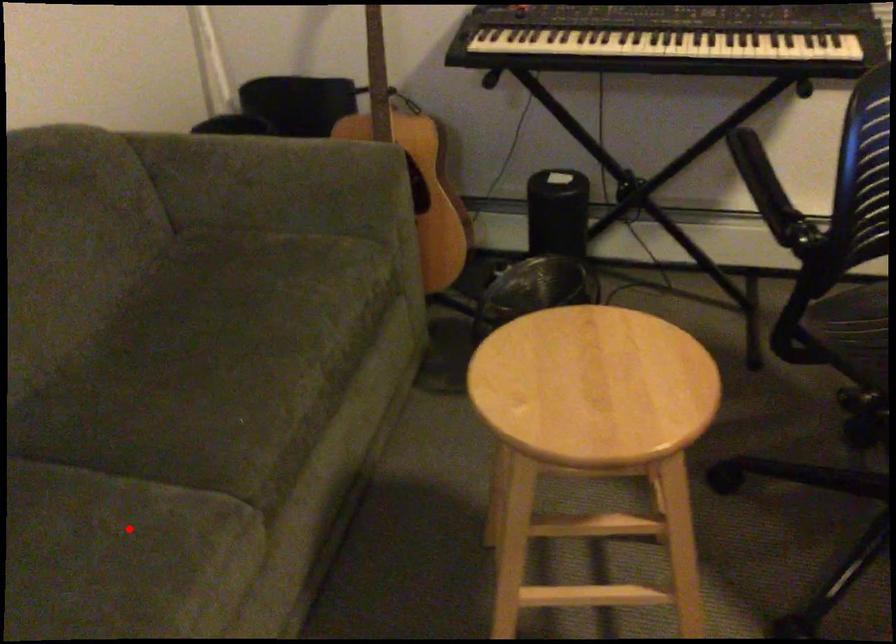
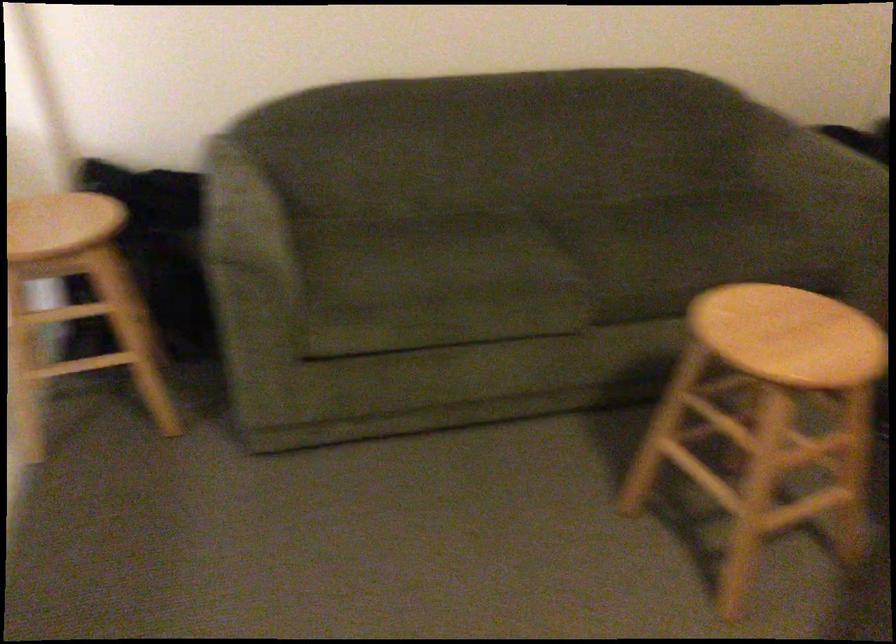
Question: I am providing you with two images of the same scene from different viewpoints. In image1, a red point is highlighted. Considering the same 3D point in image2, which of the following is correct?

Choices:
 (A) It is closer
 (B) It is farther

Answer: (B)